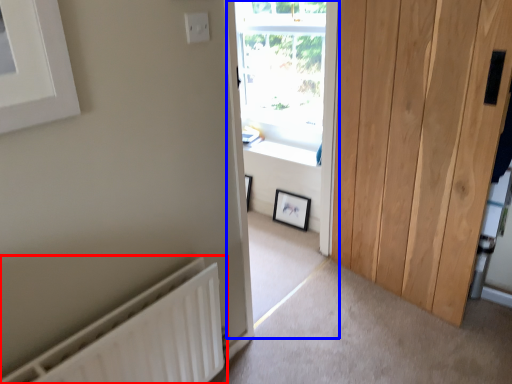
Question: Which point is further to the camera, radiator (highlighted by a red box) or window frame (highlighted by a blue box)?

Choices:
 (A) radiator
 (B) window frame

Answer: (B)